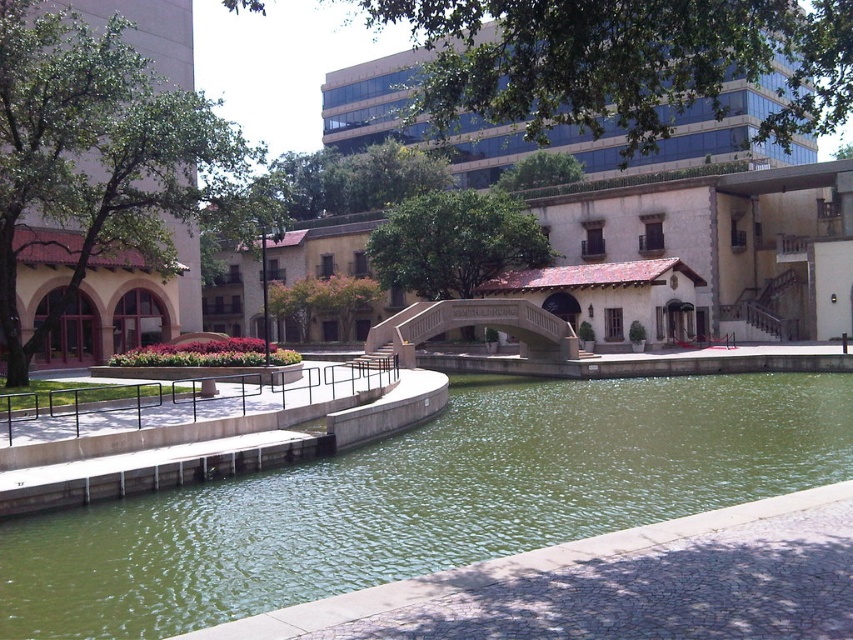
Based on the scene description, where is the green concrete river at center located in the image?

The green concrete river at center is located at point (448, 493) in the image.

You are a tourist standing on the beige stone bridge at center and want to take a photo of the green concrete river at center. In which direction should you point your camera to capture the river?

You should point your camera to the right to capture the green concrete river at center since it is located to the right of the beige stone bridge at center.

You are a city planner assessing the urban layout. You need to determine if the green concrete river at center can be crossed using the beige stone bridge at center. Can the bridge accommodate the river?

The beige stone bridge at center is taller than the green concrete river at center, so yes, the bridge can accommodate the river since its height is sufficient to allow passage over the river.